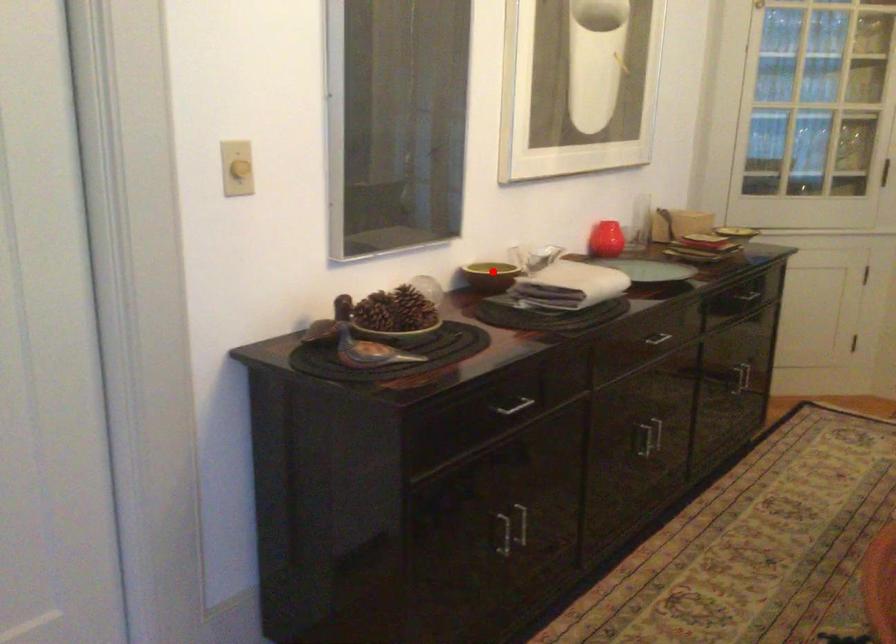
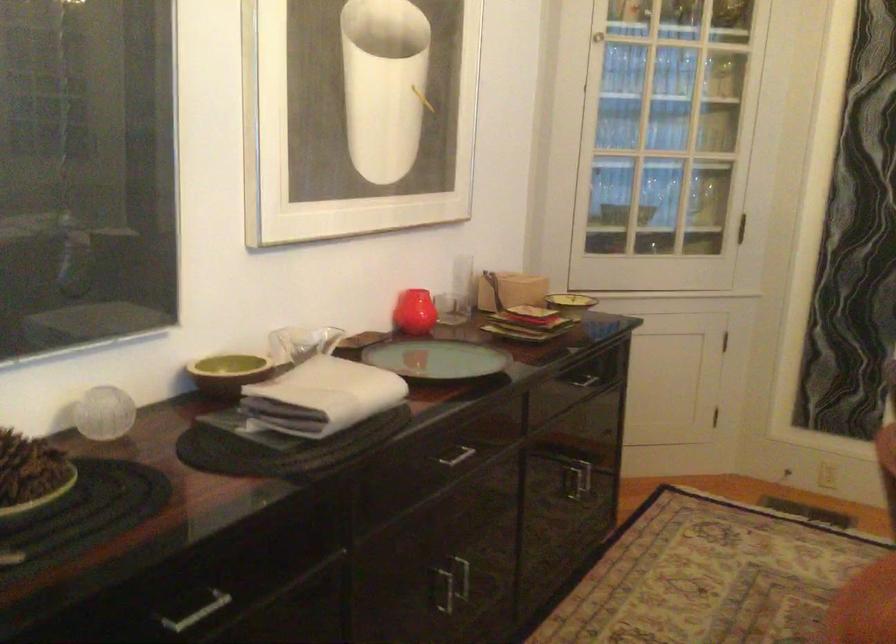
Question: I am providing you with two images of the same scene from different viewpoints. A red point is shown in image1. For the corresponding object point in image2, is it positioned nearer or farther from the camera?

Choices:
 (A) Nearer
 (B) Farther

Answer: (A)